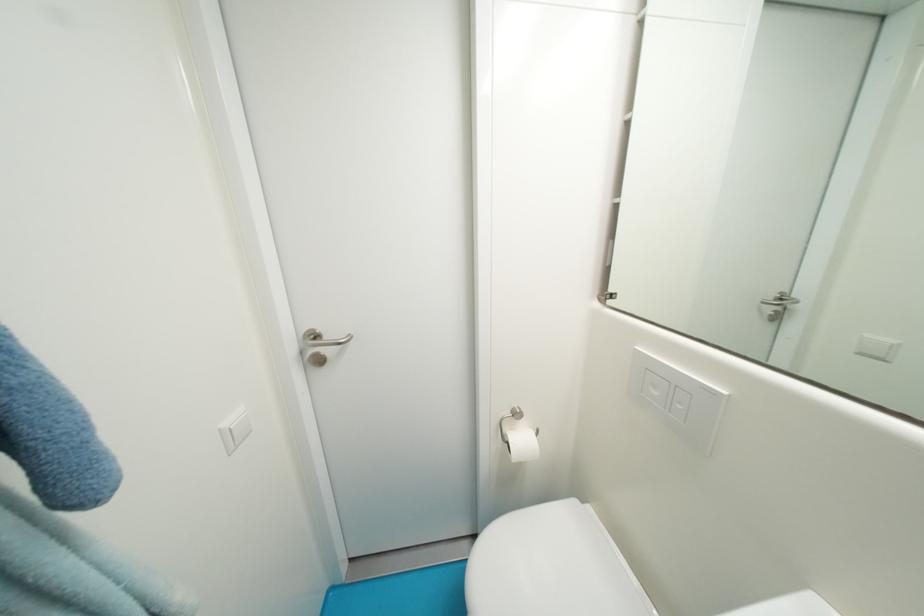
Image resolution: width=924 pixels, height=616 pixels. What do you see at coordinates (677, 399) in the screenshot? I see `the white light switch` at bounding box center [677, 399].